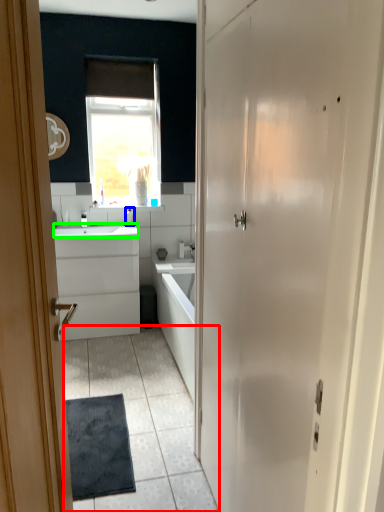
Question: Which object is positioned farthest from plain (highlighted by a red box)? Select from toiletry (highlighted by a blue box) and counter top (highlighted by a green box).

Choices:
 (A) toiletry
 (B) counter top

Answer: (A)